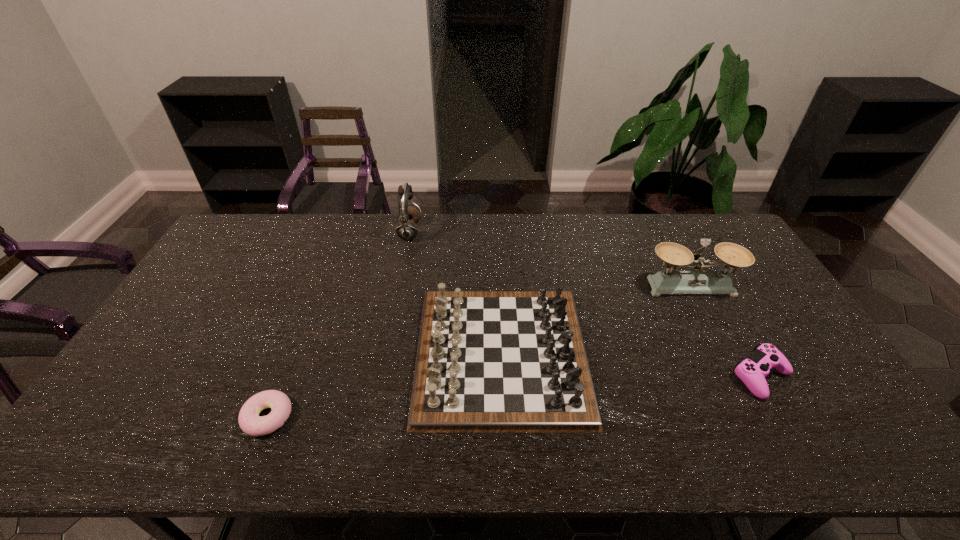
The height and width of the screenshot is (540, 960). I want to click on the fourth object from right to left, so click(x=409, y=215).

Locate an element on the screen. This screenshot has height=540, width=960. the tallest object is located at coordinates point(409,215).

Locate an element on the screen. the second tallest object is located at coordinates (699, 281).

The width and height of the screenshot is (960, 540). Find the location of `the third shortest object`. the third shortest object is located at coordinates (487, 361).

Identify the location of chessboard. The height and width of the screenshot is (540, 960). (487, 361).

The width and height of the screenshot is (960, 540). I want to click on control, so click(x=752, y=371).

At what (x,y) coordinates should I click in order to perform the action: click on the shortest object. Please return your answer as a coordinate pair (x, y). This screenshot has width=960, height=540. Looking at the image, I should click on (250, 422).

I want to click on the leftmost object, so click(250, 422).

Locate an element on the screen. vacant space positioned 0.060m on the ear pads of the earphone is located at coordinates (437, 232).

The image size is (960, 540). Find the location of `vacant space situated on the front-facing side of the scale`. vacant space situated on the front-facing side of the scale is located at coordinates (708, 318).